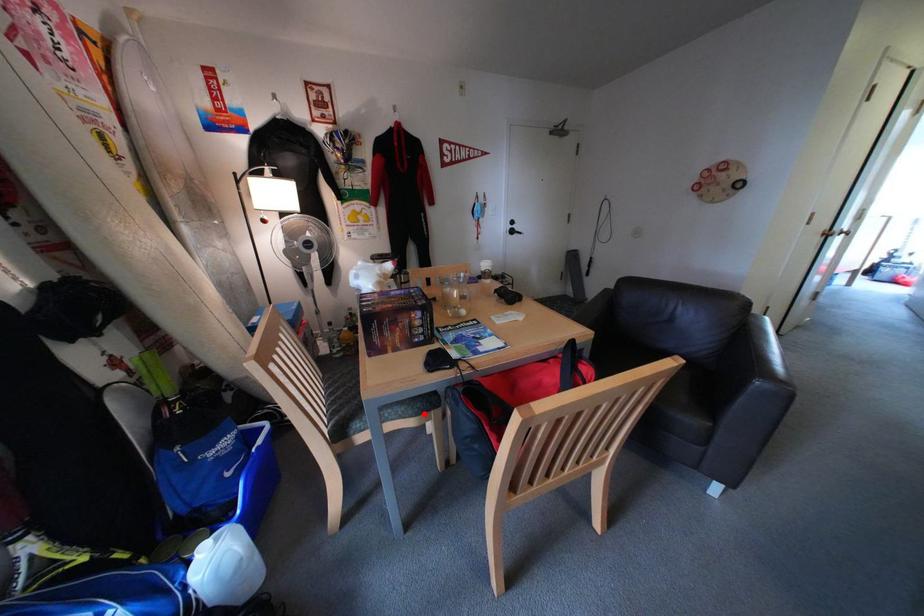
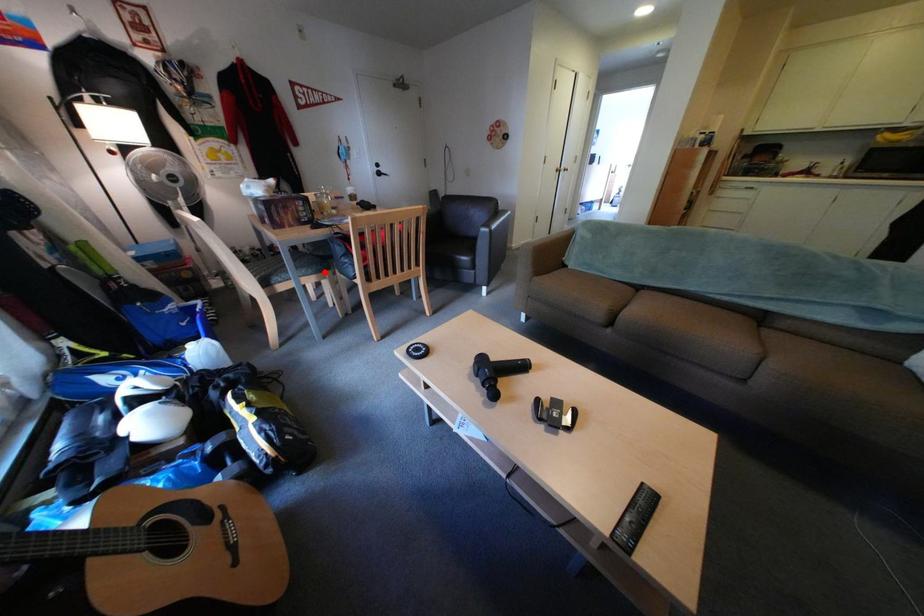
I am providing you with two images of the same scene from different viewpoints. A red point is marked on the first image and another point is marked on the second image. Is the red point in image1 aligned with the point shown in image2?

Yes